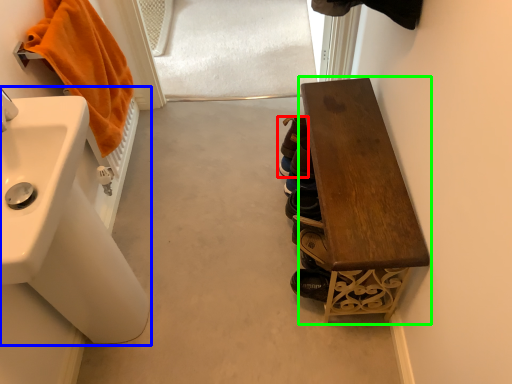
Question: Which object is positioned farthest from footwear (highlighted by a red box)? Select from sink (highlighted by a blue box) and furniture (highlighted by a green box).

Choices:
 (A) sink
 (B) furniture

Answer: (A)